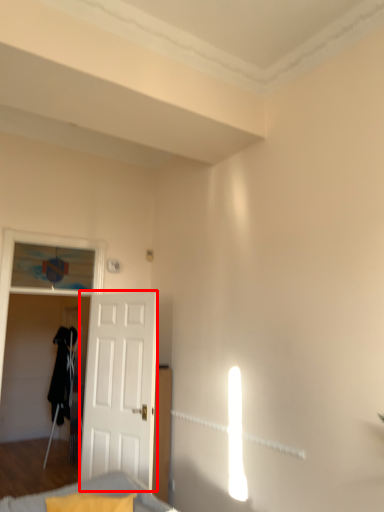
Question: From the image's perspective, where is door (annotated by the red box) located relative to furniture?

Choices:
 (A) below
 (B) above

Answer: (B)